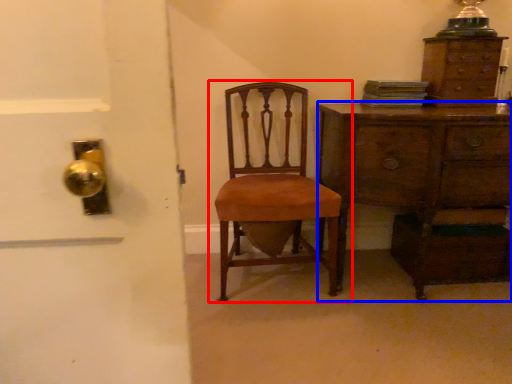
Question: Which of the following is the farthest to the observer, chair (highlighted by a red box) or chest of drawers (highlighted by a blue box)?

Choices:
 (A) chair
 (B) chest of drawers

Answer: (B)